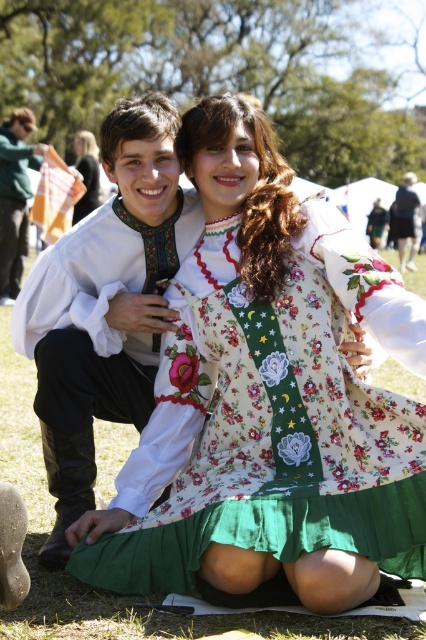
Looking at this image, you are a photographer setting up for a cultural event. You need to position a camera tripod so that both the floral cotton dress at center and the white satin shirt at center are visible in the frame. Based on their heights, which object should you adjust the tripod height to focus on first?

The floral cotton dress at center is not as tall as the white satin shirt at center, so you should adjust the tripod height to focus on the white satin shirt at center first to ensure both are visible.

You are a photographer standing at the origin point of the image. You need to adjust your camera to focus on the floral cotton dress at center. According to the coordinates provided, in which direction should you move your camera to center the dress in your view?

The floral cotton dress at center is located at coordinates point (273, 419). Since the origin is at the bottom left corner, moving the camera to the right and slightly upward would center the dress.